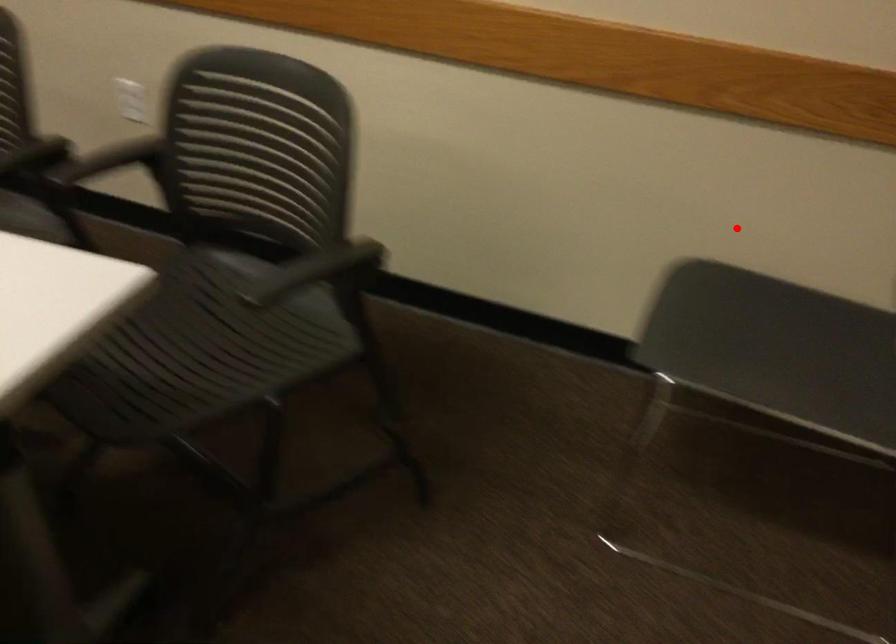
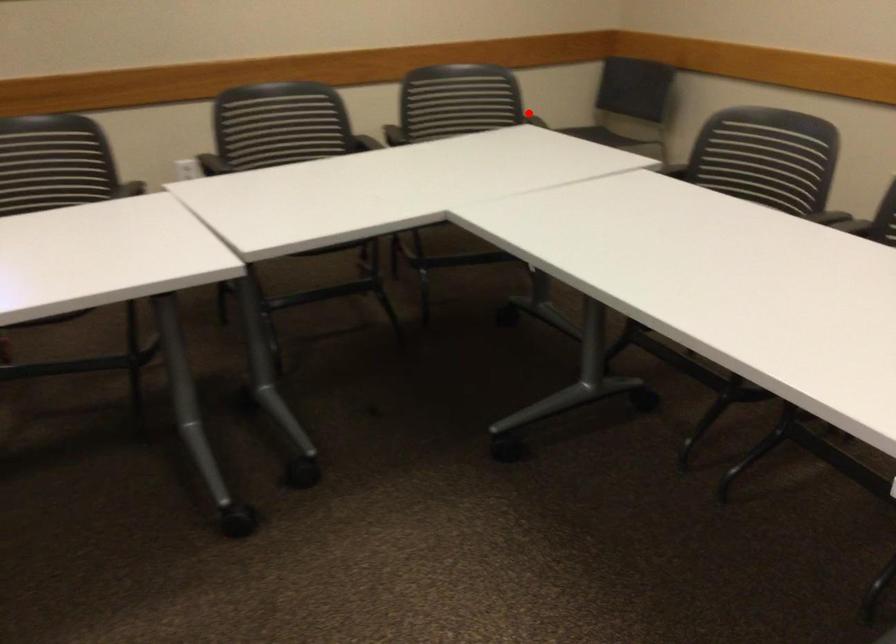
I am providing you with two images of the same scene from different viewpoints. A red point is marked on the first image and another point is marked on the second image. Do the highlighted points in image1 and image2 indicate the same real-world spot?

Yes